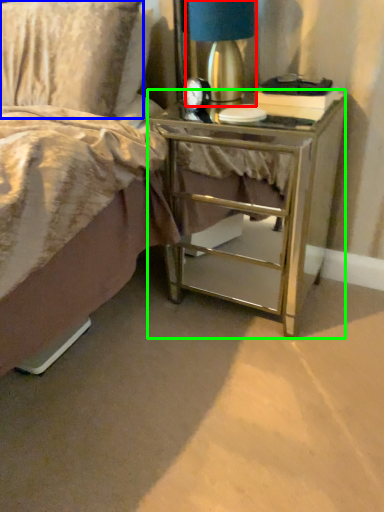
Question: Which object is positioned farthest from bedside lamp (highlighted by a red box)? Select from pillow (highlighted by a blue box) and nightstand (highlighted by a green box).

Choices:
 (A) pillow
 (B) nightstand

Answer: (B)